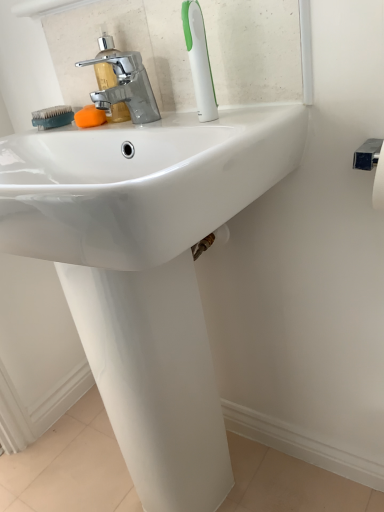
Question: Should I look upward or downward to see white plastic toothbrush at upper center?

Choices:
 (A) up
 (B) down

Answer: (A)

Question: Can you confirm if teal rubber brush at left is shorter than white plastic toothbrush at upper center?

Choices:
 (A) no
 (B) yes

Answer: (B)

Question: Does teal rubber brush at left have a lesser width compared to white plastic toothbrush at upper center?

Choices:
 (A) no
 (B) yes

Answer: (A)

Question: Does teal rubber brush at left come in front of white plastic toothbrush at upper center?

Choices:
 (A) yes
 (B) no

Answer: (B)

Question: Is teal rubber brush at left at the right side of white plastic toothbrush at upper center?

Choices:
 (A) no
 (B) yes

Answer: (A)

Question: Is teal rubber brush at left aimed at white plastic toothbrush at upper center?

Choices:
 (A) yes
 (B) no

Answer: (B)

Question: Is white plastic toothbrush at upper center at the back of teal rubber brush at left?

Choices:
 (A) no
 (B) yes

Answer: (A)

Question: Is chrome metallic faucet at upper left next to orange sponge at center and touching it?

Choices:
 (A) yes
 (B) no

Answer: (A)

Question: From a real-world perspective, is chrome metallic faucet at upper left on orange sponge at center?

Choices:
 (A) no
 (B) yes

Answer: (B)

Question: Is chrome metallic faucet at upper left positioned in front of orange sponge at center?

Choices:
 (A) yes
 (B) no

Answer: (A)

Question: Could you tell me if chrome metallic faucet at upper left is turned towards orange sponge at center?

Choices:
 (A) no
 (B) yes

Answer: (A)

Question: From the image's perspective, would you say chrome metallic faucet at upper left is shown under orange sponge at center?

Choices:
 (A) yes
 (B) no

Answer: (B)

Question: Is chrome metallic faucet at upper left to the left of orange sponge at center from the viewer's perspective?

Choices:
 (A) yes
 (B) no

Answer: (B)

Question: Is chrome metallic faucet at upper left located outside white plastic toothbrush at upper center?

Choices:
 (A) no
 (B) yes

Answer: (B)